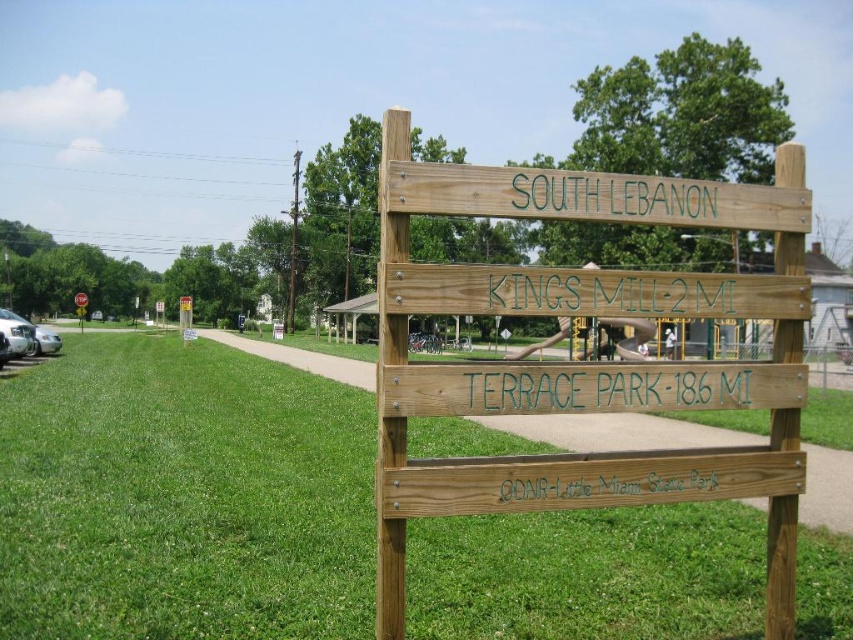
You are standing at the base of the green painted sign at center. You want to walk to the paved path that is 3.44 meters away. Which direction should you face to walk towards the paved path?

Since the paved path is 3.44 meters away from the green painted sign at center, you should face the direction where the paved path is located to walk towards it.

You are standing in a grassy area near the green painted sign at center and the green wood sign at upper center. Which sign is wider?

The green painted sign at center might be wider than green wood sign at upper center.

You are standing at the point labeled as point (x=605, y=387). What is the nearest object to you?

The nearest object to you is the green painted sign at center indicated by point (x=605, y=387).